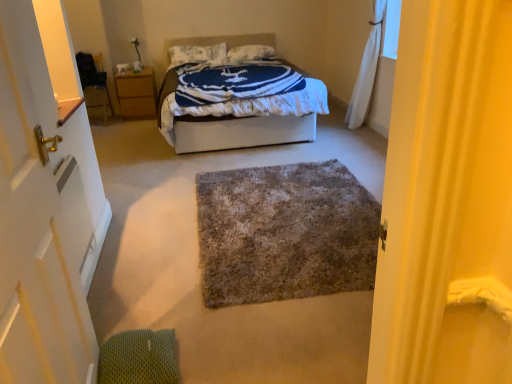
Find the location of a particular element. The width and height of the screenshot is (512, 384). vacant space in between white fabric bed at center and shaggy gray rug at center is located at coordinates (220, 170).